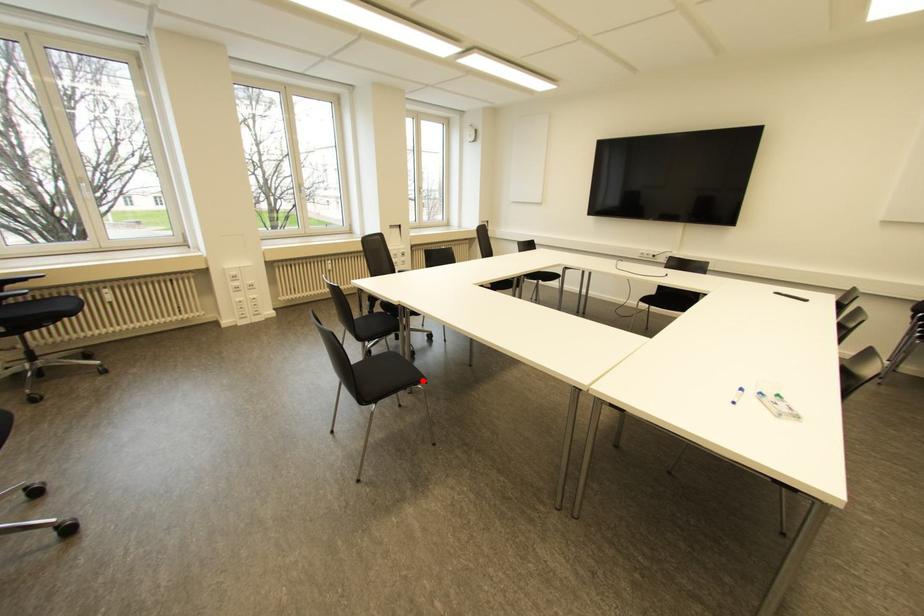
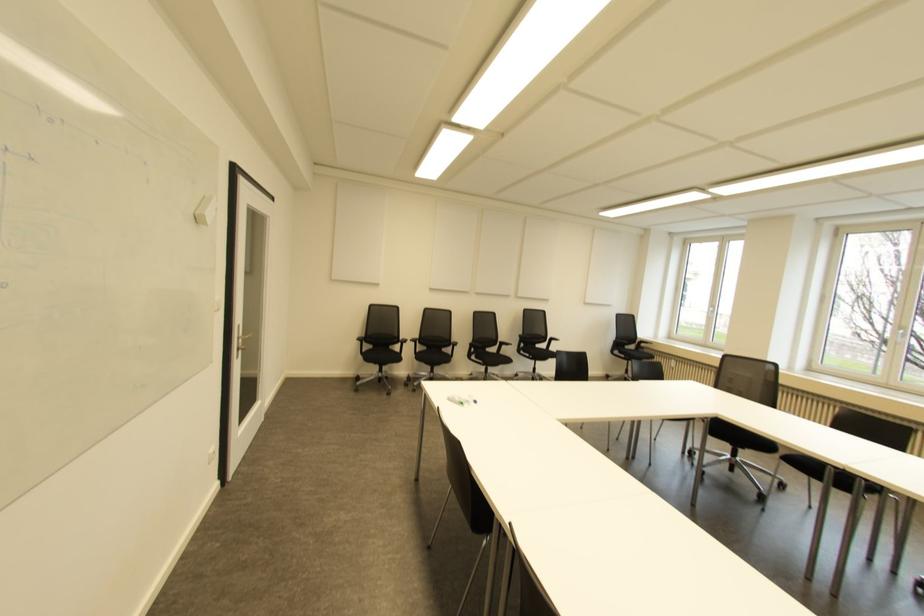
Question: I am providing you with two images of the same scene from different viewpoints. A red point is marked on the first image. Can you still see the location of the red point in image 2?

Choices:
 (A) Yes
 (B) No

Answer: (B)